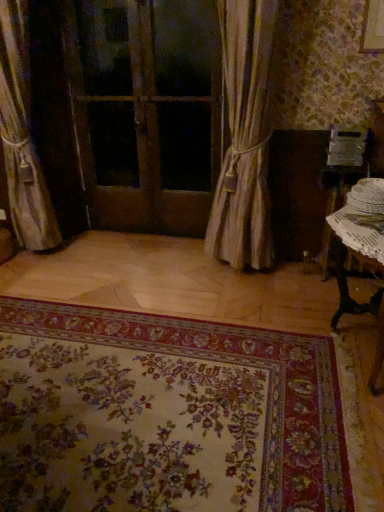
Find the location of a particular element. Image resolution: width=384 pixels, height=512 pixels. free area in between white wicker table at lower right, the second table from the back, and silky beige curtain at center, positioned as the 2th curtain in left-to-right order is located at coordinates (276, 306).